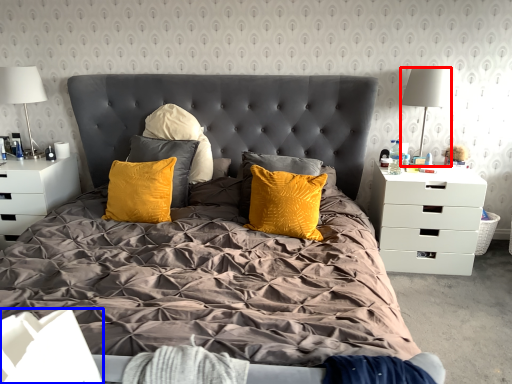
Question: Which object appears closest to the camera in this image, lamp (highlighted by a red box) or box (highlighted by a blue box)?

Choices:
 (A) lamp
 (B) box

Answer: (B)